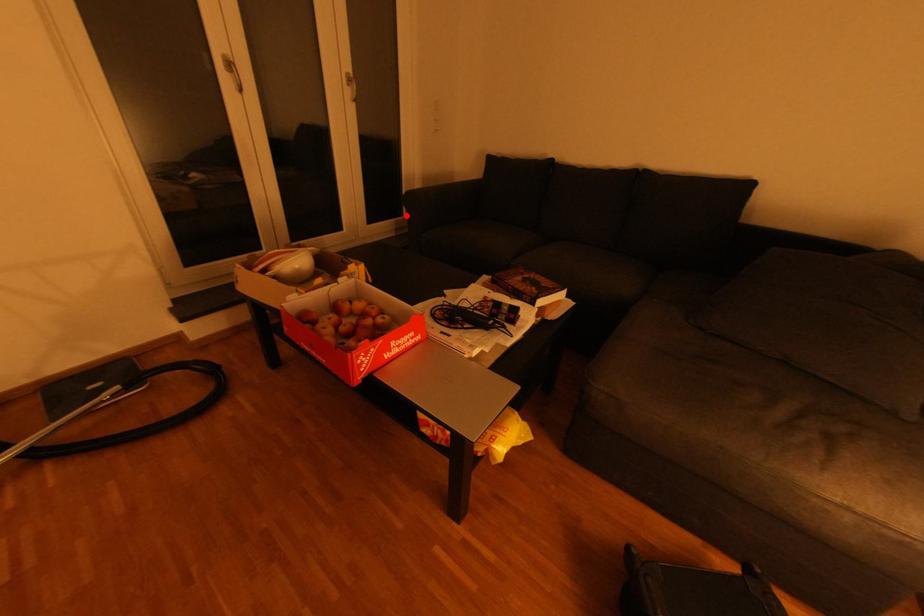
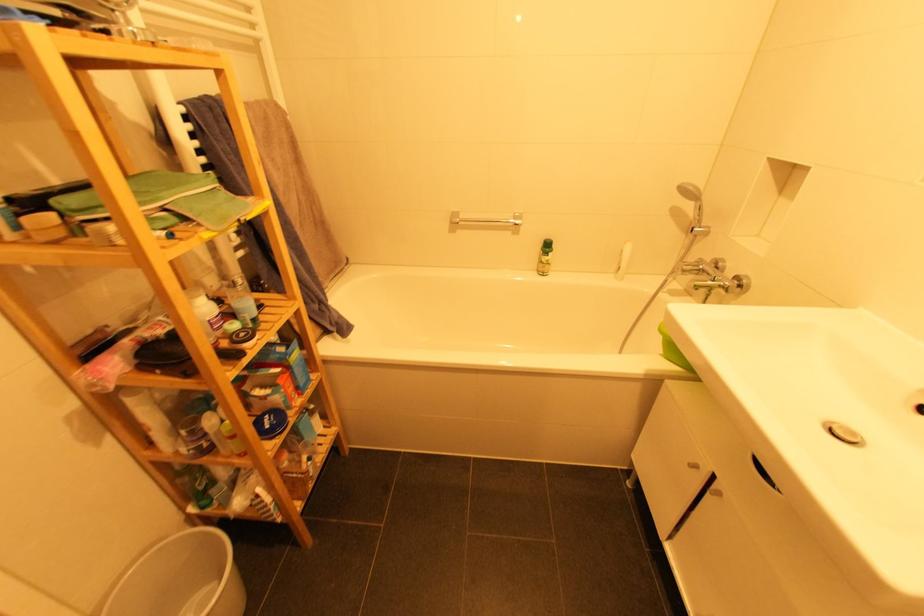
Question: I am providing you with two images of the same scene from different viewpoints. A red point is marked on the first image. Can you still see the location of the red point in image 2?

Choices:
 (A) Yes
 (B) No

Answer: (B)